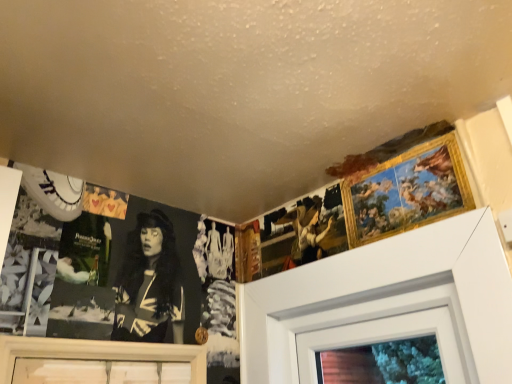
This screenshot has width=512, height=384. What do you see at coordinates (406, 192) in the screenshot?
I see `gold-framed painting at upper right` at bounding box center [406, 192].

At what (x,y) coordinates should I click in order to perform the action: click on gold-framed painting at upper right. Please return your answer as a coordinate pair (x, y). Looking at the image, I should click on (406, 192).

Where is `gold-framed painting at upper right`? gold-framed painting at upper right is located at coordinates (406, 192).